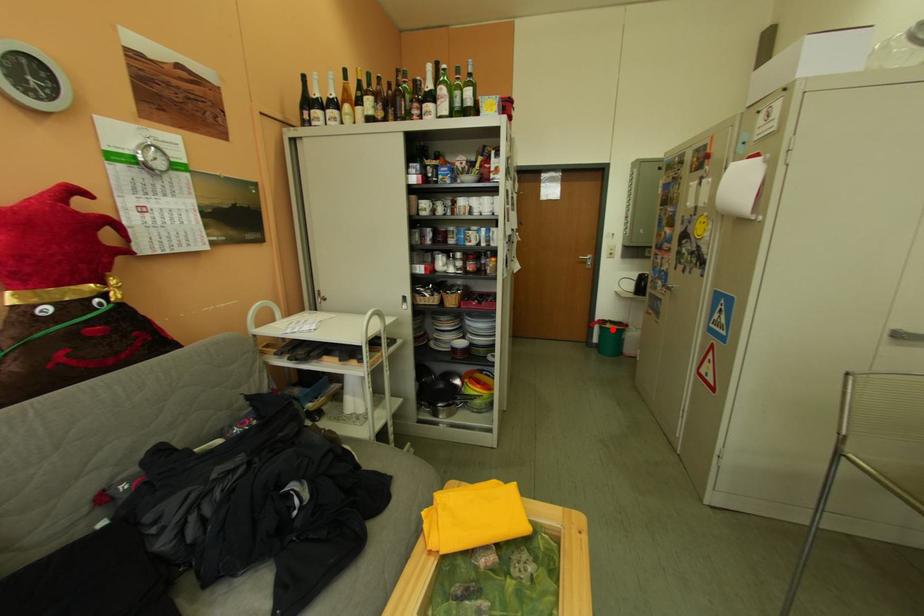
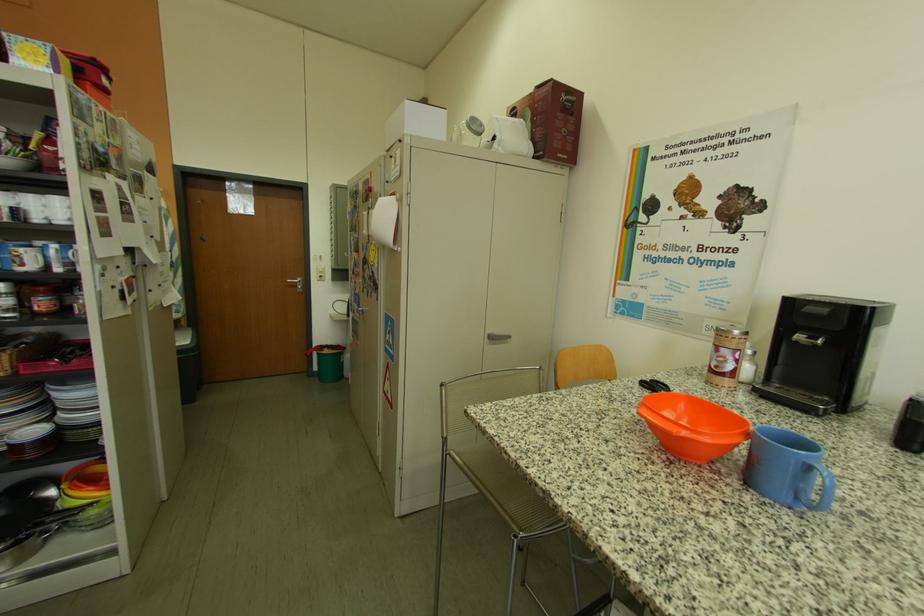
Question: I am providing you with two images of the same scene from different viewpoints. A red point is shown in image1. For the corresponding object point in image2, is it positioned nearer or farther from the camera?

Choices:
 (A) Nearer
 (B) Farther

Answer: (B)